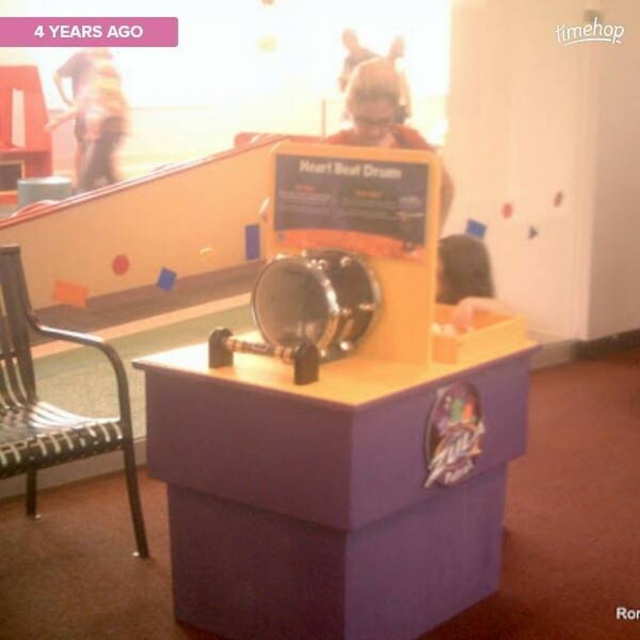
Question: Can you confirm if purple wood table at center is bigger than metallic woven chair at left?

Choices:
 (A) no
 (B) yes

Answer: (B)

Question: Does purple wood table at center have a lesser width compared to metallic woven chair at left?

Choices:
 (A) no
 (B) yes

Answer: (A)

Question: Which point is farther to the camera?

Choices:
 (A) (54, 413)
 (B) (467, 435)

Answer: (A)

Question: Observing the image, what is the correct spatial positioning of purple wood table at center in reference to metallic woven chair at left?

Choices:
 (A) above
 (B) below

Answer: (B)